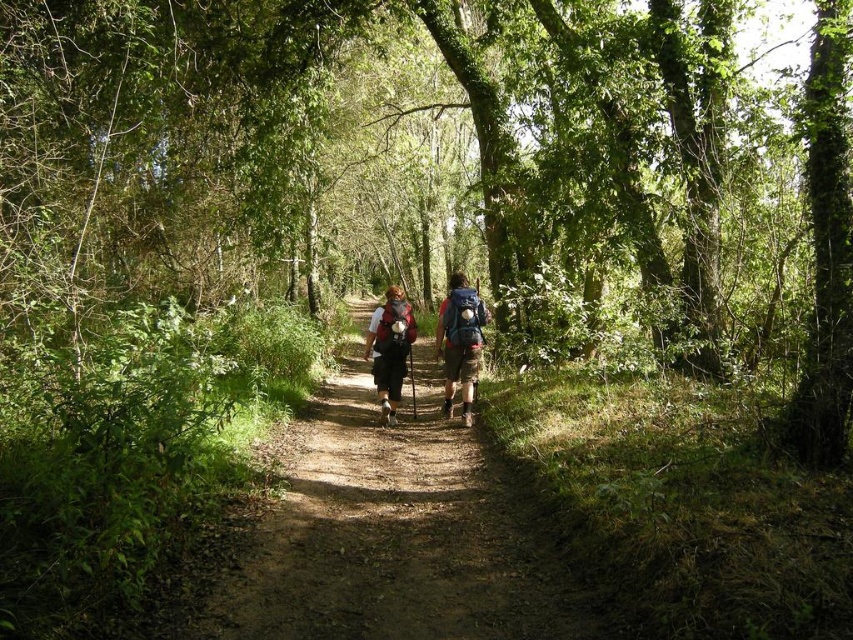
Question: Estimate the real-world distances between objects in this image. Which object is farther from the dirt path at center?

Choices:
 (A) matte fabric backpacks at center
 (B) matte black backpack at center
 (C) matte blue backpack at center

Answer: (C)

Question: Is dirt path at center further to camera compared to matte black backpack at center?

Choices:
 (A) no
 (B) yes

Answer: (A)

Question: Which object is the closest to the matte black backpack at center?

Choices:
 (A) matte fabric backpacks at center
 (B) matte blue backpack at center
 (C) dirt path at center

Answer: (A)

Question: Does dirt path at center come in front of matte blue backpack at center?

Choices:
 (A) yes
 (B) no

Answer: (A)

Question: Does matte fabric backpacks at center appear on the right side of matte black backpack at center?

Choices:
 (A) no
 (B) yes

Answer: (B)

Question: Which of the following is the farthest from the observer?

Choices:
 (A) (366, 595)
 (B) (465, 342)
 (C) (450, 404)
 (D) (379, 348)

Answer: (C)